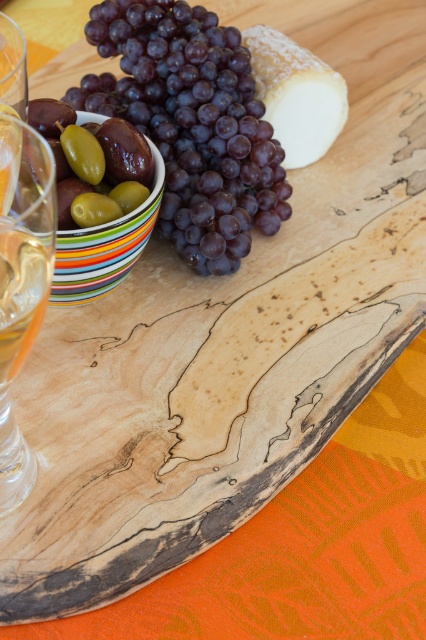
Question: Which point is farther to the camera?

Choices:
 (A) green olive at center
 (B) white creamy cheese at upper center
 (C) clear glass wine glass at left

Answer: (B)

Question: Which point appears closest to the camera in this image?

Choices:
 (A) (46, 138)
 (B) (5, 404)
 (C) (23, 300)

Answer: (C)

Question: Can you confirm if green olive at center is bigger than translucent glass at lower left?

Choices:
 (A) no
 (B) yes

Answer: (B)

Question: Which object is the closest to the translucent glass at lower left?

Choices:
 (A) green olive at center
 (B) white creamy cheese at upper center
 (C) clear glass wine glass at left
 (D) shiny purple grapes at upper left

Answer: (C)

Question: Where is white creamy cheese at upper center located in relation to translucent glass at lower left in the image?

Choices:
 (A) above
 (B) below

Answer: (A)

Question: Is white creamy cheese at upper center bigger than green olive at center?

Choices:
 (A) no
 (B) yes

Answer: (B)